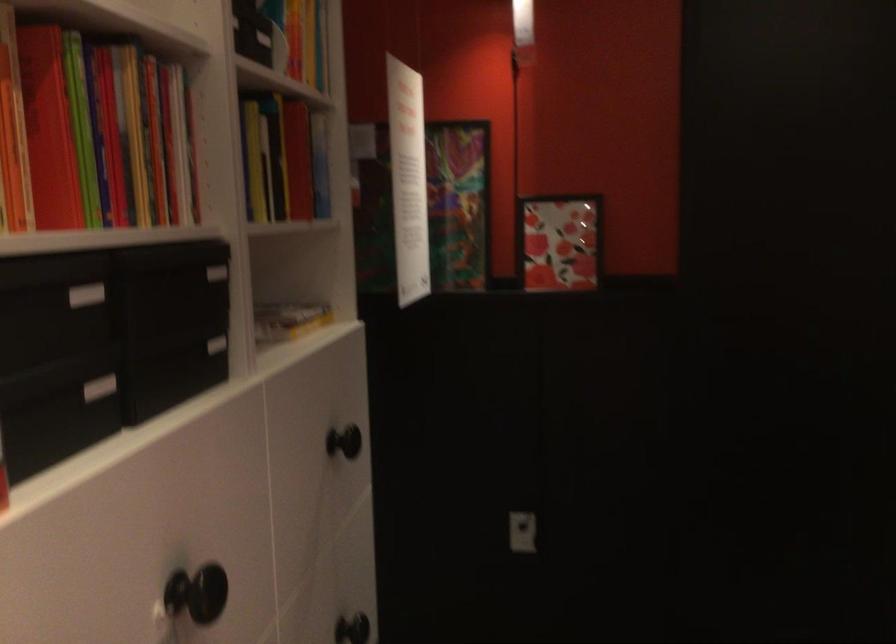
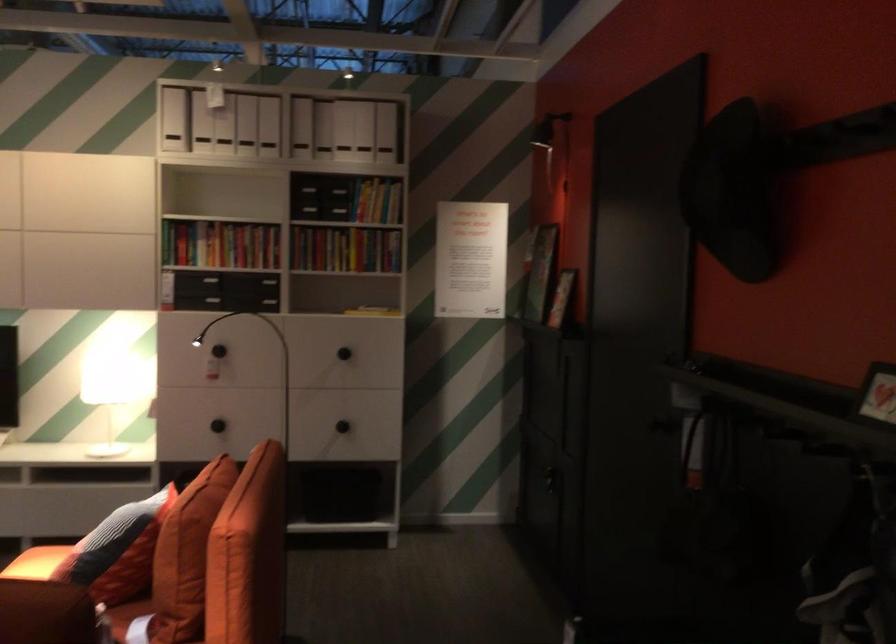
Question: I am providing you with two images of the same scene from different viewpoints. Which of the following objects are not visible in image2?

Choices:
 (A) black hat
 (B) book
 (C) window shade bar
 (D) orange throw pillow

Answer: (B)